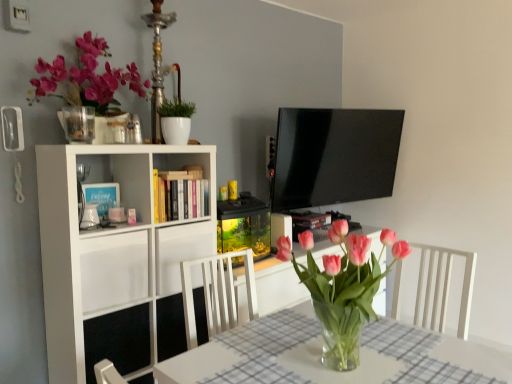
The width and height of the screenshot is (512, 384). Describe the element at coordinates (176, 120) in the screenshot. I see `white glossy pot at upper center` at that location.

Measure the distance between hardcover books at center and camera.

The depth of hardcover books at center is 2.02 meters.

The height and width of the screenshot is (384, 512). I want to click on hardcover books at center, so click(x=180, y=194).

This screenshot has width=512, height=384. What do you see at coordinates (114, 271) in the screenshot?
I see `white matte cabinet at left, acting as the second cabinet starting from the right` at bounding box center [114, 271].

The width and height of the screenshot is (512, 384). I want to click on pink glass vase at center, so click(x=343, y=287).

What do you see at coordinates (79, 124) in the screenshot? This screenshot has height=384, width=512. I see `clear glass vase at upper left` at bounding box center [79, 124].

In order to face clear glass vase at upper left, should I rotate leftwards or rightwards?

To align with it, rotate left about 22.133°.

What do you see at coordinates (321, 352) in the screenshot? I see `clear glass vase at center` at bounding box center [321, 352].

Image resolution: width=512 pixels, height=384 pixels. Find the location of `white glossy pot at upper center`. white glossy pot at upper center is located at coordinates (176, 120).

Considering their positions, is white matte cabinet at center, marked as the second cabinet in a left-to-right arrangement, located in front of or behind clear glass vase at upper left?

In the image, white matte cabinet at center, marked as the second cabinet in a left-to-right arrangement, appears behind clear glass vase at upper left.

Which is further, (212,232) or (90,138)?

The point (212,232) is behind.

Measure the distance between white matte cabinet at center, marked as the second cabinet in a left-to-right arrangement, and clear glass vase at upper left.

A distance of 25.80 inches exists between white matte cabinet at center, marked as the second cabinet in a left-to-right arrangement, and clear glass vase at upper left.

From the image's perspective, is white matte cabinet at center, marked as the second cabinet in a left-to-right arrangement, positioned above or below clear glass vase at upper left?

white matte cabinet at center, marked as the second cabinet in a left-to-right arrangement, is below clear glass vase at upper left.

Are white matte cabinet at left, acting as the second cabinet starting from the right, and matte pink flowers at upper left making contact?

No, white matte cabinet at left, acting as the second cabinet starting from the right, is not beside matte pink flowers at upper left.

From the image's perspective, between white matte cabinet at left, the first cabinet in the left-to-right sequence, and matte pink flowers at upper left, which one is located above?

From the image's view, matte pink flowers at upper left is above.

Looking at this image, can you confirm if white matte cabinet at left, the first cabinet in the left-to-right sequence, is shorter than matte pink flowers at upper left?

Yes, white matte cabinet at left, the first cabinet in the left-to-right sequence, is shorter than matte pink flowers at upper left.

From a real-world perspective, is white matte cabinet at left, acting as the second cabinet starting from the right, below matte pink flowers at upper left?

Yes.

How far apart are white glossy pot at upper center and pink glass vase at center?

A distance of 3.57 feet exists between white glossy pot at upper center and pink glass vase at center.

Find the location of a particular element. This screenshot has width=512, height=384. floral arrangement below the white glossy pot at upper center (from a real-world perspective) is located at coordinates (343, 287).

Consider the image. From the image's perspective, which one is positioned lower, white glossy pot at upper center or pink glass vase at center?

pink glass vase at center, from the image's perspective.

Can you confirm if white glossy pot at upper center is bigger than pink glass vase at center?

Actually, white glossy pot at upper center might be smaller than pink glass vase at center.

Considering the positions of point (277, 243) and point (194, 169), is point (277, 243) closer or farther from the camera than point (194, 169)?

Point (277, 243) appears to be closer to the viewer than point (194, 169).

Which of these two, pink glass vase at center or hardcover books at center, is bigger?

pink glass vase at center.

Consider the image. How many degrees apart are the facing directions of pink glass vase at center and hardcover books at center?

pink glass vase at center and hardcover books at center are facing 1.25 degrees away from each other.

In the scene shown: From a real-world perspective, between pink glass vase at center and hardcover books at center, who is vertically lower?

pink glass vase at center, from a real-world perspective.

Which is more to the right, pink glass vase at center or white matte cabinet at center, marked as the second cabinet in a left-to-right arrangement?

pink glass vase at center is more to the right.

How distant is pink glass vase at center from white matte cabinet at center, which is the first cabinet from right to left?

27.83 inches.

Does pink glass vase at center have a greater height compared to white matte cabinet at center, marked as the second cabinet in a left-to-right arrangement?

Yes.

Is pink glass vase at center turned away from white matte cabinet at center, marked as the second cabinet in a left-to-right arrangement?

Yes, pink glass vase at center is positioned with its back facing white matte cabinet at center, marked as the second cabinet in a left-to-right arrangement.

Looking at this image, is white glossy pot at upper center not near matte pink flowers at upper left?

Actually, white glossy pot at upper center and matte pink flowers at upper left are a little close together.

Which is farther from the camera, (170, 124) or (38, 96)?

The point (170, 124) is farther from the camera.

From the picture: Can you tell me how much white glossy pot at upper center and matte pink flowers at upper left differ in facing direction?

The angular difference between white glossy pot at upper center and matte pink flowers at upper left is 0.538 degrees.

Considering the positions of objects white glossy pot at upper center and matte pink flowers at upper left in the image provided, who is more to the left, white glossy pot at upper center or matte pink flowers at upper left?

From the viewer's perspective, matte pink flowers at upper left appears more on the left side.

Is white matte cabinet at left, acting as the second cabinet starting from the right, thinner than pink glass vase at center?

In fact, white matte cabinet at left, acting as the second cabinet starting from the right, might be wider than pink glass vase at center.

From the image's perspective, is white matte cabinet at left, the first cabinet in the left-to-right sequence, over pink glass vase at center?

Actually, white matte cabinet at left, the first cabinet in the left-to-right sequence, appears below pink glass vase at center in the image.

Can you tell me how much white matte cabinet at left, the first cabinet in the left-to-right sequence, and pink glass vase at center differ in facing direction?

There is a 2.77-degree angle between the facing directions of white matte cabinet at left, the first cabinet in the left-to-right sequence, and pink glass vase at center.

Who is shorter, white matte cabinet at left, the first cabinet in the left-to-right sequence, or pink glass vase at center?

With less height is white matte cabinet at left, the first cabinet in the left-to-right sequence.

I want to click on vase on the left of white matte cabinet at center, marked as the second cabinet in a left-to-right arrangement, so pos(79,124).

Locate an element on the screen. Image resolution: width=512 pixels, height=384 pixels. cabinet that is the 1st object directly below the matte pink flowers at upper left (from a real-world perspective) is located at coordinates (114, 271).

From the image, which object appears to be nearer to pink glass vase at center, matte pink flowers at upper left or clear glass vase at upper left?

clear glass vase at upper left lies closer to pink glass vase at center than the other object.

Estimate the real-world distances between objects in this image. Which object is further from white matte cabinet at center, marked as the second cabinet in a left-to-right arrangement, white matte bookcase at left or matte pink flowers at upper left?

Among the two, matte pink flowers at upper left is located further to white matte cabinet at center, marked as the second cabinet in a left-to-right arrangement.

From the image, which object appears to be farther from pink glass vase at center, clear glass vase at upper left or white matte bookcase at left?

clear glass vase at upper left.

From the image, which object appears to be nearer to white matte bookcase at left, pink glass vase at center or white matte cabinet at left, the first cabinet in the left-to-right sequence?

Based on the image, white matte cabinet at left, the first cabinet in the left-to-right sequence, appears to be nearer to white matte bookcase at left.

Estimate the real-world distances between objects in this image. Which object is closer to pink glass vase at center, white glossy pot at upper center or white matte cabinet at left, the first cabinet in the left-to-right sequence?

The object closer to pink glass vase at center is white matte cabinet at left, the first cabinet in the left-to-right sequence.

Based on their spatial positions, is clear glass vase at upper left or white glossy pot at upper center closer to hardcover books at center?

white glossy pot at upper center.

Looking at the image, which one is located further to white glossy pot at upper center, white matte cabinet at left, acting as the second cabinet starting from the right, or white matte cabinet at center, which is the first cabinet from right to left?

white matte cabinet at left, acting as the second cabinet starting from the right, is positioned further to the anchor white glossy pot at upper center.

Looking at the image, which one is located further to white matte bookcase at left, white matte cabinet at left, acting as the second cabinet starting from the right, or white matte cabinet at center, which is the first cabinet from right to left?

Based on the image, white matte cabinet at center, which is the first cabinet from right to left, appears to be further to white matte bookcase at left.

Find the location of a particular element. bookcase positioned between pink glass vase at center and white glossy pot at upper center from near to far is located at coordinates (111, 244).

The height and width of the screenshot is (384, 512). Identify the location of bookcase between matte pink flowers at upper left and clear glass vase at center vertically. (111, 244).

You are a GUI agent. You are given a task and a screenshot of the screen. Output one action in this format:
    pyautogui.click(x=<x>, y=<y>)
    Task: Click on the bookcase between pink glass vase at center and hardcover books at center along the z-axis
    
    Given the screenshot: What is the action you would take?
    pyautogui.click(x=111, y=244)

This screenshot has height=384, width=512. Find the location of `book that lies between matte pink flowers at upper left and white matte cabinet at left, acting as the second cabinet starting from the right, from top to bottom`. book that lies between matte pink flowers at upper left and white matte cabinet at left, acting as the second cabinet starting from the right, from top to bottom is located at coordinates (180, 194).